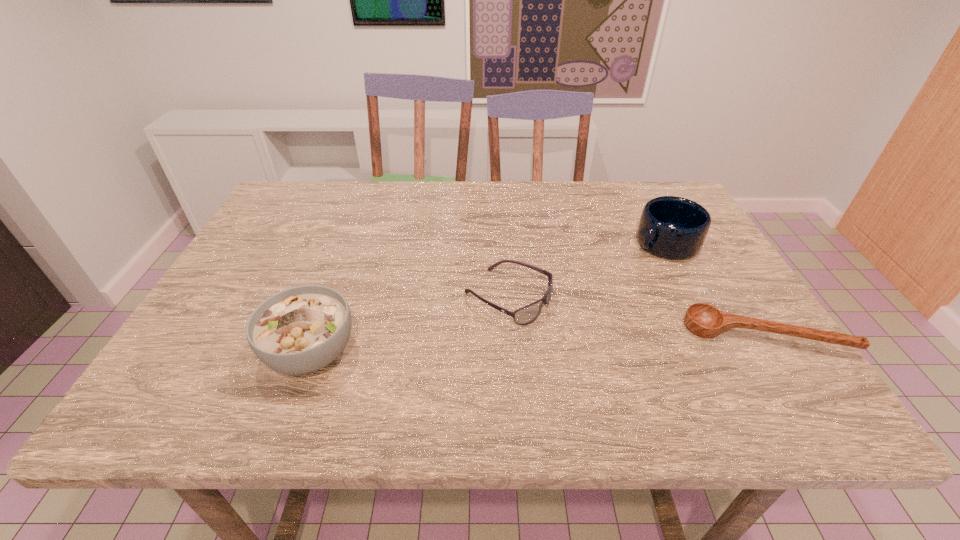
You are a GUI agent. You are given a task and a screenshot of the screen. Output one action in this format:
    pyautogui.click(x=<x>, y=<y>)
    Task: Click on the vacant spot on the desktop that is between the soup bowl and the wooden spoon and is positioned on the lenses of the sunglasses
    The width and height of the screenshot is (960, 540).
    Given the screenshot: What is the action you would take?
    pyautogui.click(x=602, y=341)

You are a GUI agent. You are given a task and a screenshot of the screen. Output one action in this format:
    pyautogui.click(x=<x>, y=<y>)
    Task: Click on the vacant spot on the desktop that is between the leftmost object and the wooden spoon and is positioned with the handle on the side of the mug
    The height and width of the screenshot is (540, 960).
    Given the screenshot: What is the action you would take?
    [x=495, y=346]